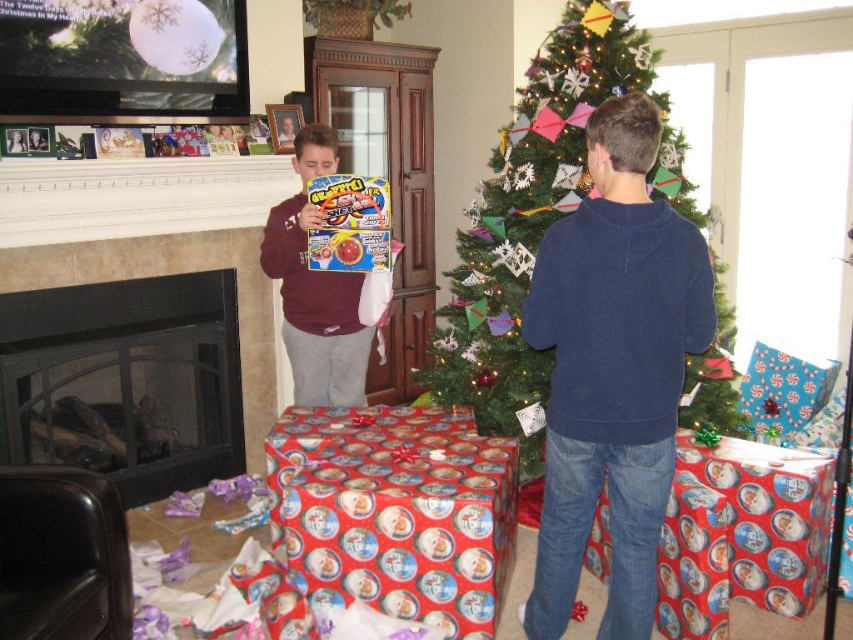
From the picture: Is red shiny wrapping paper at lower center closer to camera compared to glossy plastic game at center?

Yes, red shiny wrapping paper at lower center is closer to the viewer.

You are a GUI agent. You are given a task and a screenshot of the screen. Output one action in this format:
    pyautogui.click(x=<x>, y=<y>)
    Task: Click on the red shiny wrapping paper at lower center
    
    Given the screenshot: What is the action you would take?
    (x=395, y=512)

At what (x,y) coordinates should I click in order to perform the action: click on red shiny wrapping paper at lower center. Please return your answer as a coordinate pair (x, y). Looking at the image, I should click on (395, 512).

Based on the photo, can you confirm if dark blue sweater at center is taller than red shiny wrapping paper at lower center?

Correct, dark blue sweater at center is much taller as red shiny wrapping paper at lower center.

Who is shorter, dark blue sweater at center or red shiny wrapping paper at lower center?

red shiny wrapping paper at lower center

Find the location of a particular element. This screenshot has width=853, height=640. dark blue sweater at center is located at coordinates (613, 371).

Does green matte christmas tree at center have a larger size compared to glossy plastic game at center?

Indeed, green matte christmas tree at center has a larger size compared to glossy plastic game at center.

Between green matte christmas tree at center and glossy plastic game at center, which one appears on the right side from the viewer's perspective?

Positioned to the right is green matte christmas tree at center.

Is point (531, 234) closer to camera compared to point (334, 244)?

No.

Image resolution: width=853 pixels, height=640 pixels. In order to click on green matte christmas tree at center in this screenshot , I will do `click(537, 218)`.